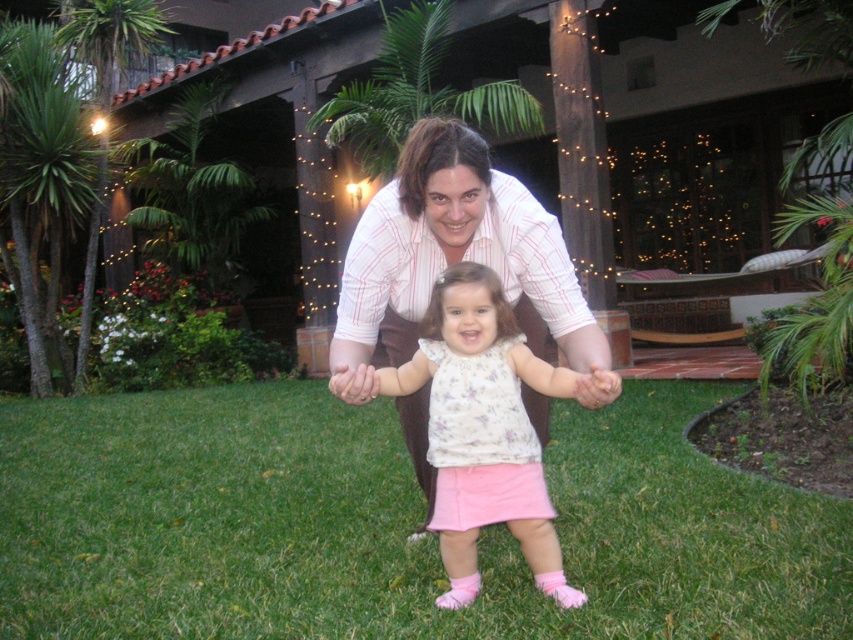
You are a photographer trying to capture the child in the light pink cotton dress at center without any obstructions. Given that the green grass at center is in front of the dress, can you adjust your position to ensure the dress is fully visible?

The light pink cotton dress at center is behind the green grass at center. By moving your camera angle slightly upwards or to the side, you can position the dress so it is no longer blocked by the grass, ensuring full visibility.

You are standing at the point labeled as point (387, 524) in the image. What is the terrain like at that location?

The point (387, 524) indicates green grass at center, so the terrain at that location is green grass.

You are a photographer standing in the garden and want to take a photo of the green grass at center and the light pink cotton dress at center. Which object is shorter?

The green grass at center is shorter than the light pink cotton dress at center.